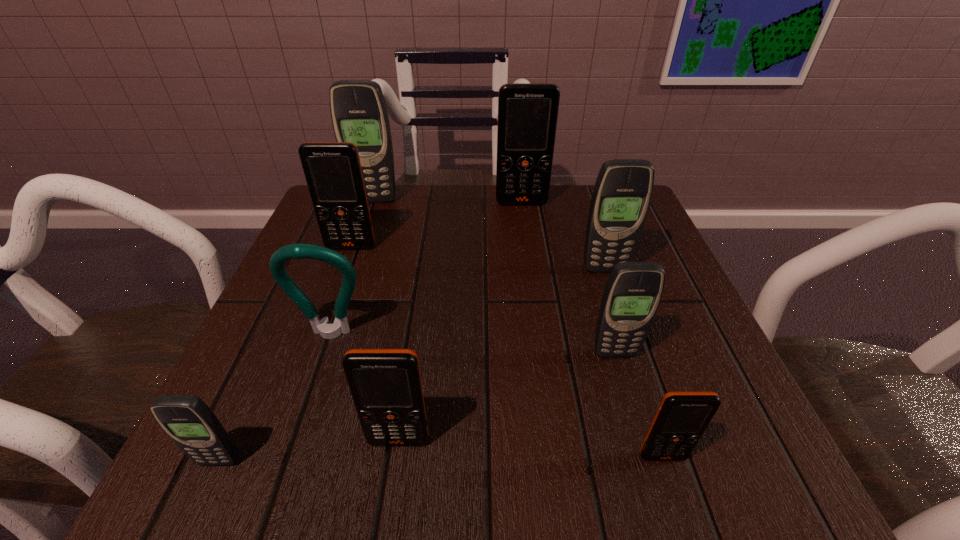
You are a GUI agent. You are given a task and a screenshot of the screen. Output one action in this format:
    pyautogui.click(x=<x>, y=<y>)
    Task: Click on the vacant area between the farthest gray cellular telephone and the second orange cellular telephone from right to left
    The image size is (960, 540).
    Given the screenshot: What is the action you would take?
    pyautogui.click(x=448, y=201)

Identify the location of object that ranks as the third closest to the sixth farthest cellular telephone. The width and height of the screenshot is (960, 540). (682, 417).

The width and height of the screenshot is (960, 540). In order to click on object that stands as the fifth closest to the smallest gray cellular telephone in this screenshot , I will do `click(682, 417)`.

Identify the location of cellular telephone that is the fourth closest to the bottle opener. (633, 291).

Locate an element on the screen. The width and height of the screenshot is (960, 540). cellular telephone that stands as the fourth closest to the second nearest orange cellular telephone is located at coordinates (333, 173).

Locate which orange cellular telephone is the third closest to the third nearest gray cellular telephone. Please provide its 2D coordinates. Your answer should be formatted as a tuple, i.e. [(x, y)], where the tuple contains the x and y coordinates of a point satisfying the conditions above.

[(333, 173)]

At what (x,y) coordinates should I click in order to perform the action: click on orange cellular telephone object that ranks as the third closest to the fifth farthest object. Please return your answer as a coordinate pair (x, y). The image size is (960, 540). Looking at the image, I should click on (682, 417).

The width and height of the screenshot is (960, 540). Find the location of `gray cellular telephone identified as the second closest to the farthest gray cellular telephone`. gray cellular telephone identified as the second closest to the farthest gray cellular telephone is located at coordinates (633, 291).

Point out which gray cellular telephone is positioned as the third nearest to the fifth nearest object. Please provide its 2D coordinates. Your answer should be formatted as a tuple, i.e. [(x, y)], where the tuple contains the x and y coordinates of a point satisfying the conditions above.

[(359, 114)]